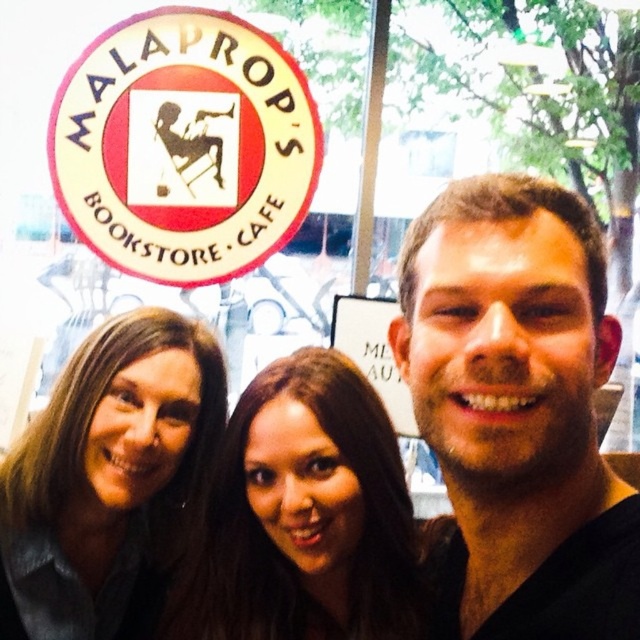
Is brown hair at upper left wider than brown hair at center?

Incorrect, brown hair at upper left's width does not surpass brown hair at center's.

Locate an element on the screen. brown hair at upper left is located at coordinates tap(108, 476).

Where is `brown hair at upper left`? The image size is (640, 640). brown hair at upper left is located at coordinates (108, 476).

Does black matte face at center have a lesser height compared to brown hair at center?

No.

Which is behind, point (468, 307) or point (250, 540)?

The point (250, 540) is more distant.

Identify the location of black matte face at center. This screenshot has height=640, width=640. (518, 404).

Is black matte face at center positioned in front of brown hair at upper left?

That is True.

From the picture: Who is more forward, (586, 348) or (17, 442)?

Point (586, 348)

Locate an element on the screen. This screenshot has width=640, height=640. black matte face at center is located at coordinates (518, 404).